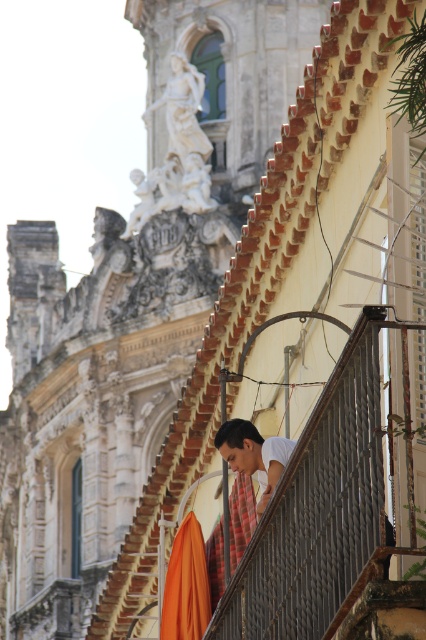
Question: Which object is closer to the camera taking this photo?

Choices:
 (A) white matte shirt at center
 (B) orange fabric umbrella at lower center

Answer: (A)

Question: Which of the following is the farthest from the observer?

Choices:
 (A) (175, 563)
 (B) (268, 497)

Answer: (A)

Question: Which point is farther from the camera taking this photo?

Choices:
 (A) (181, 522)
 (B) (226, 424)

Answer: (A)

Question: Is orange fabric umbrella at lower center above white matte shirt at center?

Choices:
 (A) no
 (B) yes

Answer: (A)

Question: Can you confirm if orange fabric umbrella at lower center is thinner than white matte shirt at center?

Choices:
 (A) yes
 (B) no

Answer: (A)

Question: Does orange fabric umbrella at lower center appear under white matte shirt at center?

Choices:
 (A) no
 (B) yes

Answer: (B)